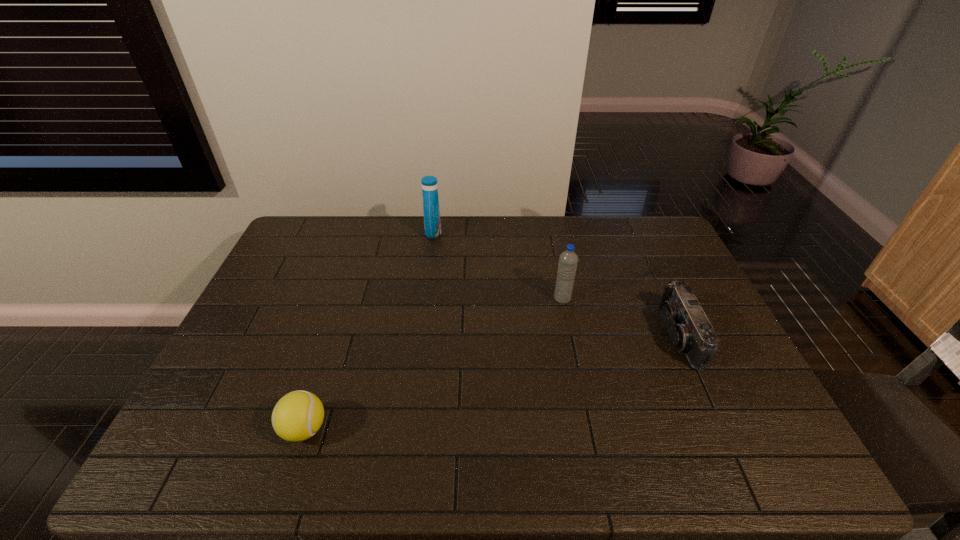
Find the location of a particular element. The height and width of the screenshot is (540, 960). free location that satisfies the following two spatial constraints: 1. on the front-facing side of the farthest object; 2. on the back side of the water bottle is located at coordinates (424, 299).

Where is `vacant region that satisfies the following two spatial constraints: 1. on the back side of the third object from left to right; 2. on the front-facing side of the farthest object`? vacant region that satisfies the following two spatial constraints: 1. on the back side of the third object from left to right; 2. on the front-facing side of the farthest object is located at coordinates (549, 232).

The height and width of the screenshot is (540, 960). What are the coordinates of `vacant area in the image that satisfies the following two spatial constraints: 1. on the front-facing side of the camcorder; 2. on the front side of the nearest object` in the screenshot? It's located at (721, 429).